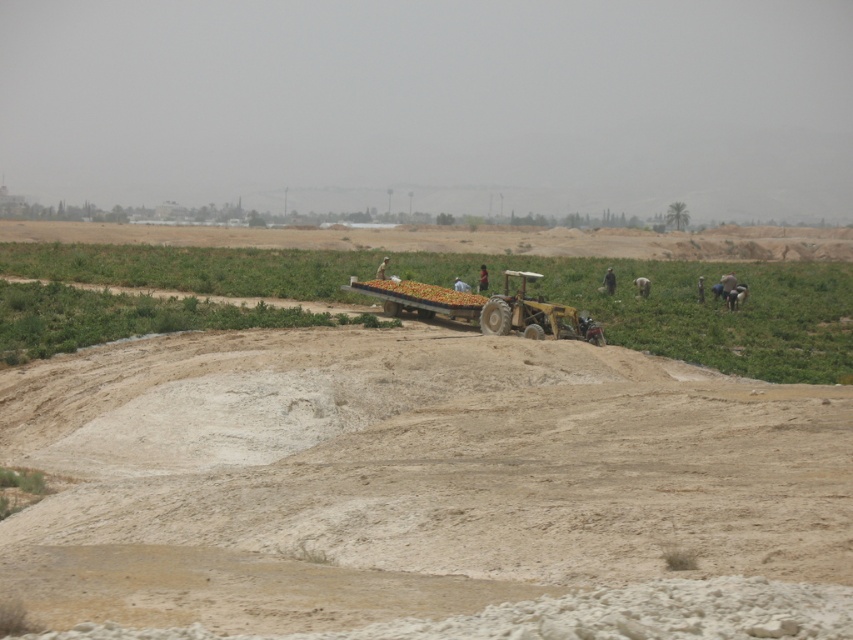
You are a farmer planning to drive your metallic trailer truck at center across the light brown sandy at center. Considering the width of the sandy area, will the truck fit without needing to adjust its path?

The light brown sandy at center might be wider than metallic trailer truck at center, so there is a possibility that the truck can fit without needing to adjust its path. However, since the width comparison is uncertain, cautious planning is advised.

You are a farmer who needs to move the metallic trailer truck at center to a different location. Considering the terrain, which direction should you move it to avoid getting stuck in the light brown sandy at center?

The light brown sandy at center is on the left side of the metallic trailer truck at center, so to avoid getting stuck, you should move the metallic trailer truck at center to the right side away from the sandy area.

Based on the photo, you are standing at the base of the sandy embankment and see the two points marked in the scene. Which point, point (791, 532) or point (502, 310), is closer to your current position?

Point (791, 532) is in front of point (502, 310), so it is closer to your current position at the base of the sandy embankment.